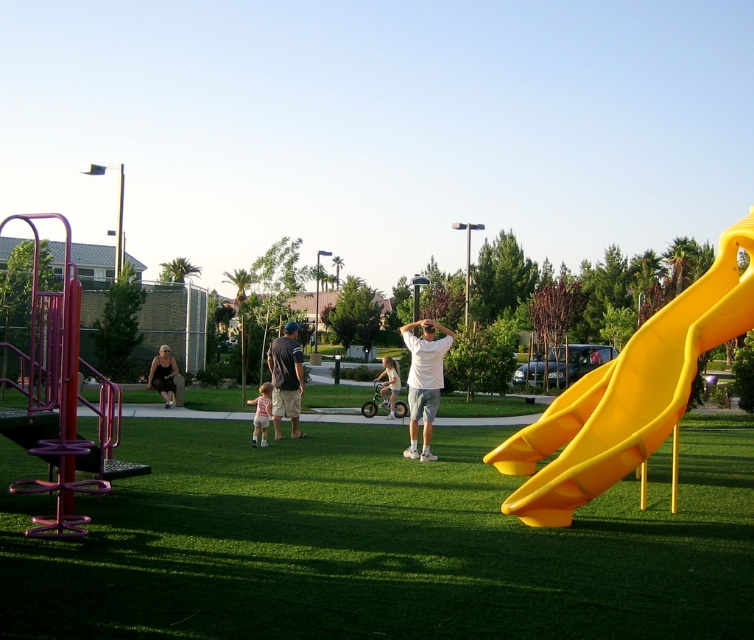
You are a photographer standing at the playground and want to take a photo of both the dark gray shirt at center and the light pink fabric dress at center. Which one will appear closer to you in the photo?

The dark gray shirt at center will appear closer to you in the photo because it is positioned further to the viewer than the light pink fabric dress at center.